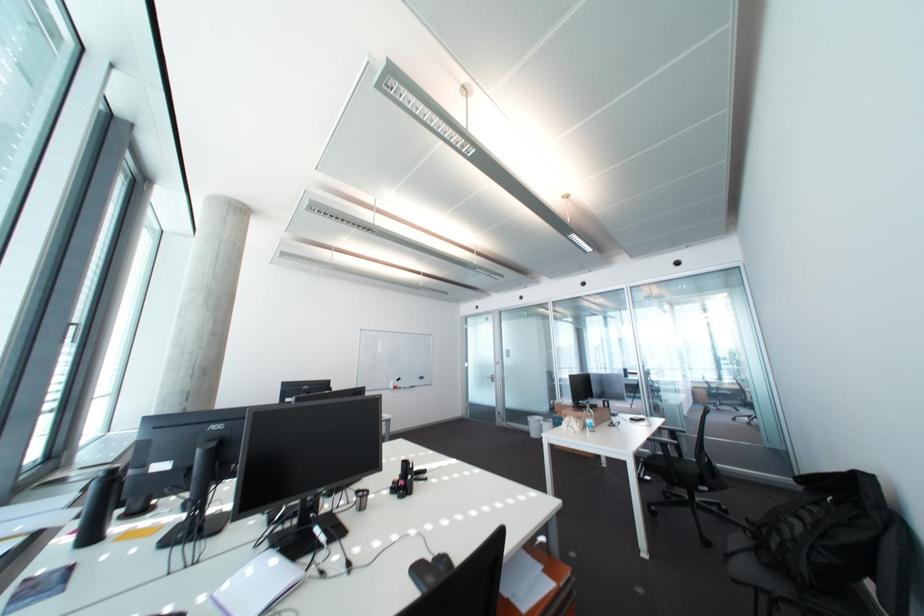
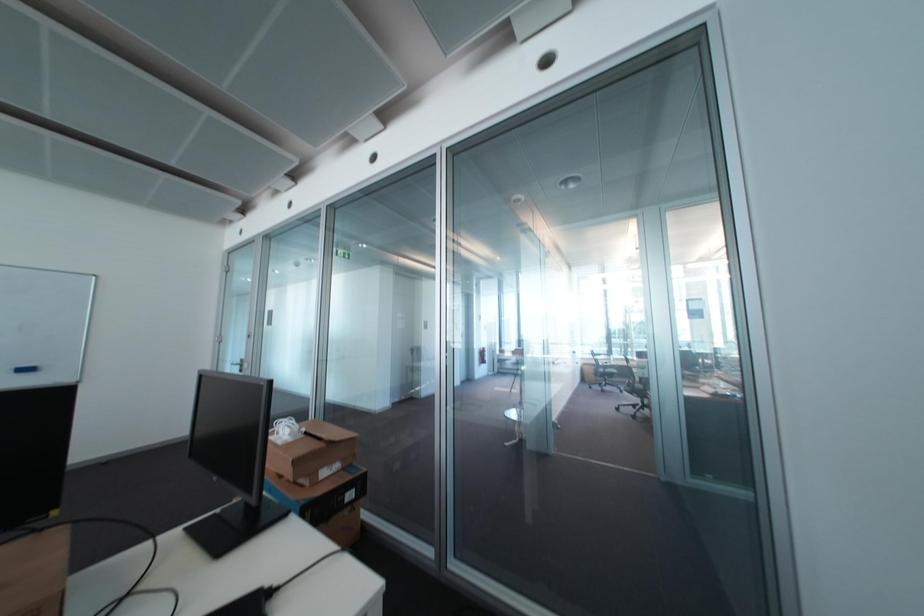
What movement of the cameraman would produce the second image?

The cameraman moved toward right, forward.